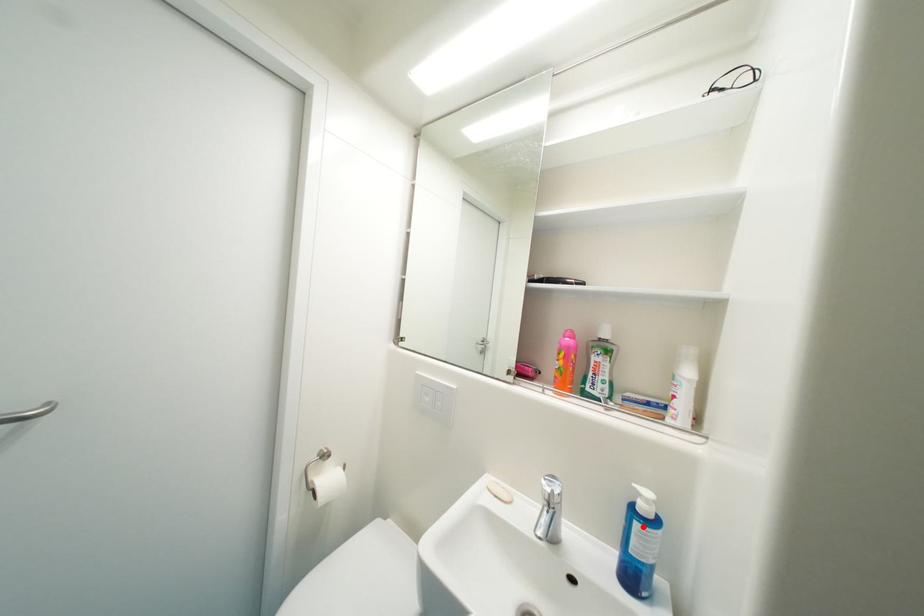
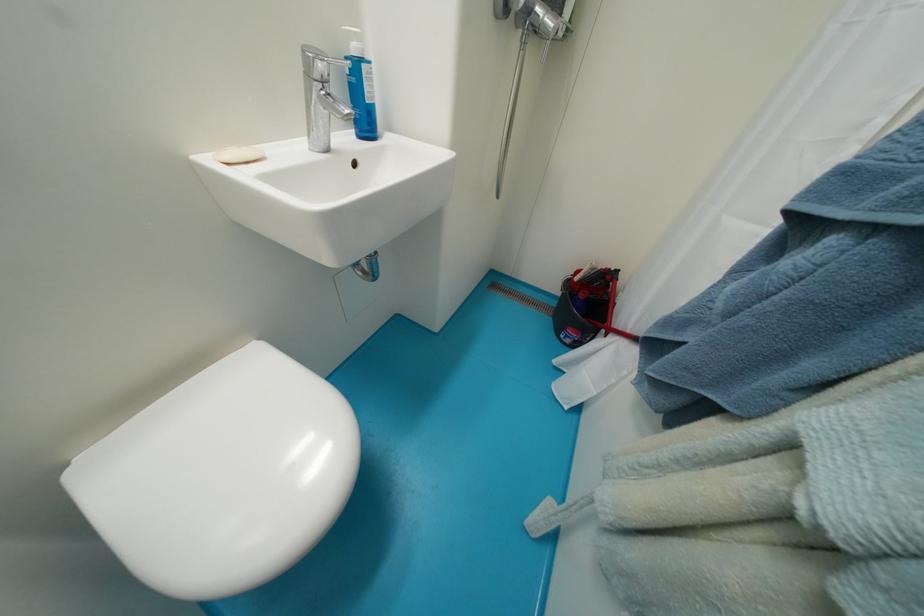
In the second image, find the point that corresponds to the highlighted location in the first image.

(371, 70)